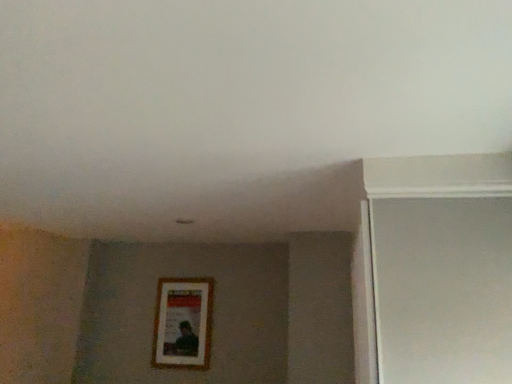
You are a GUI agent. You are given a task and a screenshot of the screen. Output one action in this format:
    pyautogui.click(x=<x>, y=<y>)
    Task: Click on the white matte screen door at right
    This screenshot has width=512, height=384.
    Given the screenshot: What is the action you would take?
    pyautogui.click(x=442, y=289)

What do you see at coordinates (442, 289) in the screenshot? This screenshot has width=512, height=384. I see `white matte screen door at right` at bounding box center [442, 289].

This screenshot has height=384, width=512. What do you see at coordinates (183, 323) in the screenshot?
I see `wooden picture frame at center` at bounding box center [183, 323].

Locate an element on the screen. wooden picture frame at center is located at coordinates (183, 323).

Measure the distance between point (187, 359) and camera.

Point (187, 359) and camera are 2.79 meters apart.

At what (x,y) coordinates should I click in order to perform the action: click on white matte screen door at right. Please return your answer as a coordinate pair (x, y). This screenshot has height=384, width=512. Looking at the image, I should click on (442, 289).

Considering the positions of objects wooden picture frame at center and white matte screen door at right in the image provided, who is more to the left, wooden picture frame at center or white matte screen door at right?

wooden picture frame at center is more to the left.

Relative to white matte screen door at right, is wooden picture frame at center in front or behind?

wooden picture frame at center is positioned farther from the viewer than white matte screen door at right.

Considering the positions of point (209, 287) and point (405, 244), is point (209, 287) closer or farther from the camera than point (405, 244)?

Point (209, 287) appears to be farther away from the viewer than point (405, 244).

From the image's perspective, is wooden picture frame at center above white matte screen door at right?

No, from the image's perspective, wooden picture frame at center is not above white matte screen door at right.

From a real-world perspective, which object rests below the other?

From a 3D spatial view, wooden picture frame at center is below.

Is wooden picture frame at center thinner than white matte screen door at right?

Indeed, wooden picture frame at center has a lesser width compared to white matte screen door at right.

Is wooden picture frame at center taller or shorter than white matte screen door at right?

Clearly, wooden picture frame at center is shorter compared to white matte screen door at right.

Considering the sizes of wooden picture frame at center and white matte screen door at right in the image, is wooden picture frame at center bigger or smaller than white matte screen door at right?

Considering their sizes, wooden picture frame at center takes up less space than white matte screen door at right.

Choose the correct answer: Is wooden picture frame at center inside white matte screen door at right or outside it?

wooden picture frame at center is outside white matte screen door at right.

Is the surface of wooden picture frame at center in direct contact with white matte screen door at right?

No, wooden picture frame at center is not making contact with white matte screen door at right.

Is wooden picture frame at center positioned with its back to white matte screen door at right?

No, white matte screen door at right is not at the back of wooden picture frame at center.

Identify the location of picture frame on the left of white matte screen door at right. (183, 323).

Would you say white matte screen door at right is to the left or to the right of wooden picture frame at center in the picture?

white matte screen door at right is to the right of wooden picture frame at center.

Between white matte screen door at right and wooden picture frame at center, which one is positioned in front?

white matte screen door at right.

Does point (404, 241) come closer to viewer compared to point (191, 300)?

Yes, it is in front of point (191, 300).

From the image's perspective, who appears lower, white matte screen door at right or wooden picture frame at center?

wooden picture frame at center appears lower in the image.

From a real-world perspective, is white matte screen door at right above or below wooden picture frame at center?

In terms of real-world spatial position, white matte screen door at right is above wooden picture frame at center.

Which of these two, white matte screen door at right or wooden picture frame at center, is wider?

white matte screen door at right.

Considering the sizes of objects white matte screen door at right and wooden picture frame at center in the image provided, who is taller, white matte screen door at right or wooden picture frame at center?

white matte screen door at right is taller.

In the scene shown: Can you confirm if white matte screen door at right is bigger than wooden picture frame at center?

Indeed, white matte screen door at right has a larger size compared to wooden picture frame at center.

Is white matte screen door at right spatially inside wooden picture frame at center, or outside of it?

white matte screen door at right lies outside wooden picture frame at center.

Is there a large distance between white matte screen door at right and wooden picture frame at center?

Yes, white matte screen door at right and wooden picture frame at center are quite far apart.

Is white matte screen door at right aimed at wooden picture frame at center?

Yes, white matte screen door at right faces towards wooden picture frame at center.

At what (x,y) coordinates should I click in order to perform the action: click on screen door located above the wooden picture frame at center (from a real-world perspective). Please return your answer as a coordinate pair (x, y). The height and width of the screenshot is (384, 512). Looking at the image, I should click on (442, 289).

This screenshot has height=384, width=512. In order to click on picture frame located below the white matte screen door at right (from the image's perspective) in this screenshot , I will do `click(183, 323)`.

The image size is (512, 384). In the image, there is a white matte screen door at right. What are the coordinates of `picture frame below it (from a real-world perspective)` in the screenshot? It's located at (183, 323).